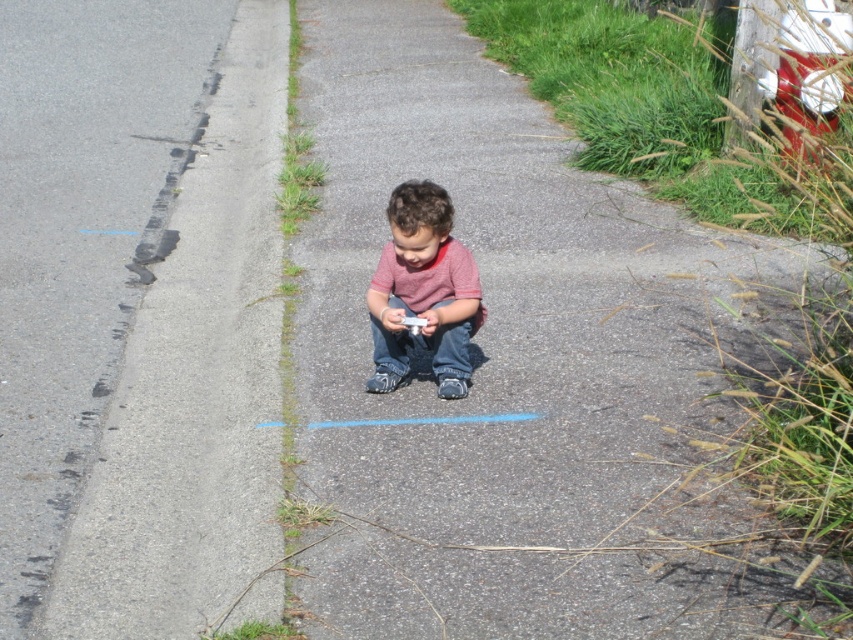
Question: Is gray asphalt at lower left wider than matte pink shirt at center?

Choices:
 (A) no
 (B) yes

Answer: (B)

Question: Based on their relative distances, which object is nearer to the matte pink shirt at center?

Choices:
 (A) gray asphalt pavement at center
 (B) gray asphalt at lower left

Answer: (A)

Question: Which object appears closest to the camera in this image?

Choices:
 (A) gray asphalt at lower left
 (B) matte pink shirt at center
 (C) gray asphalt pavement at center

Answer: (C)

Question: Among these objects, which one is farthest from the camera?

Choices:
 (A) gray asphalt pavement at center
 (B) gray asphalt at lower left

Answer: (B)

Question: Is gray asphalt pavement at center above matte pink shirt at center?

Choices:
 (A) yes
 (B) no

Answer: (A)

Question: Where is gray asphalt pavement at center located in relation to gray asphalt at lower left in the image?

Choices:
 (A) right
 (B) left

Answer: (A)